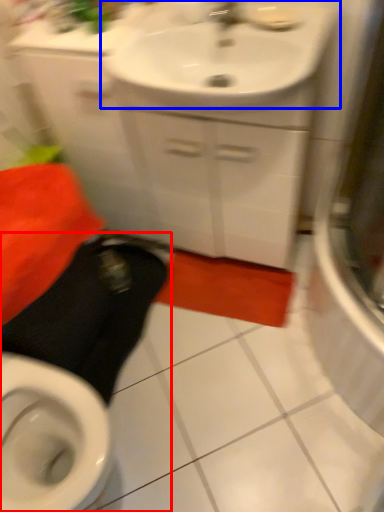
Question: Among these objects, which one is nearest to the camera, squat (highlighted by a red box) or sink (highlighted by a blue box)?

Choices:
 (A) squat
 (B) sink

Answer: (A)